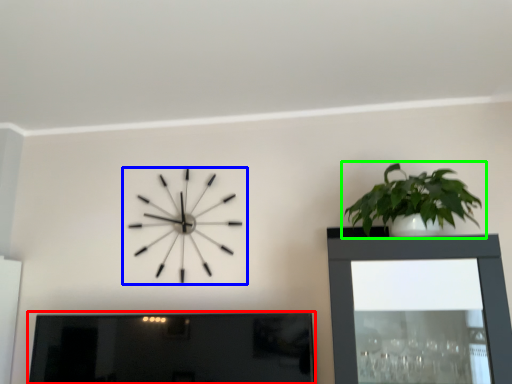
Question: Based on their relative distances, which object is nearer to picture frame (highlighted by a red box)? Choose from wall clock (highlighted by a blue box) and houseplant (highlighted by a green box).

Choices:
 (A) wall clock
 (B) houseplant

Answer: (A)